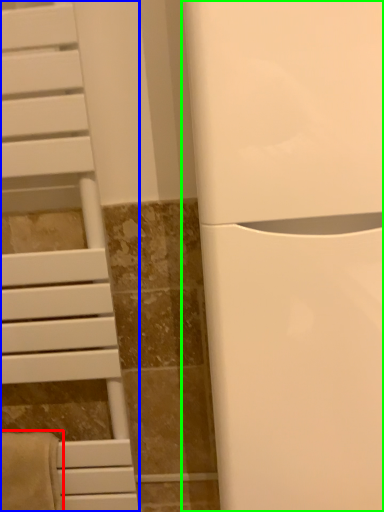
Question: Based on their relative distances, which object is farther from bath towel (highlighted by a red box)? Choose from furniture (highlighted by a blue box) and appliance (highlighted by a green box).

Choices:
 (A) furniture
 (B) appliance

Answer: (B)